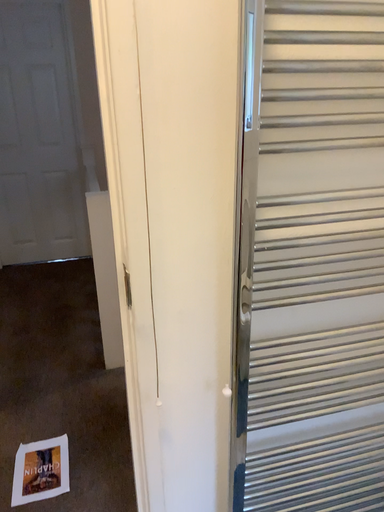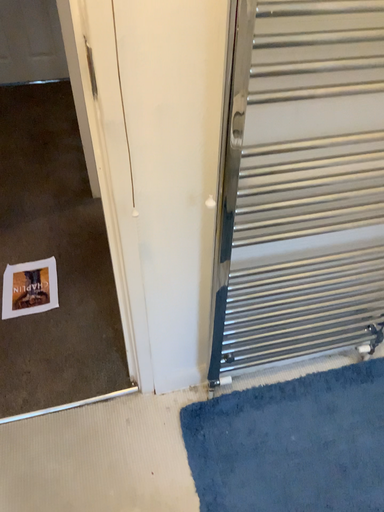
Question: How did the camera likely rotate when shooting the video?

Choices:
 (A) rotated downward
 (B) rotated upward

Answer: (A)